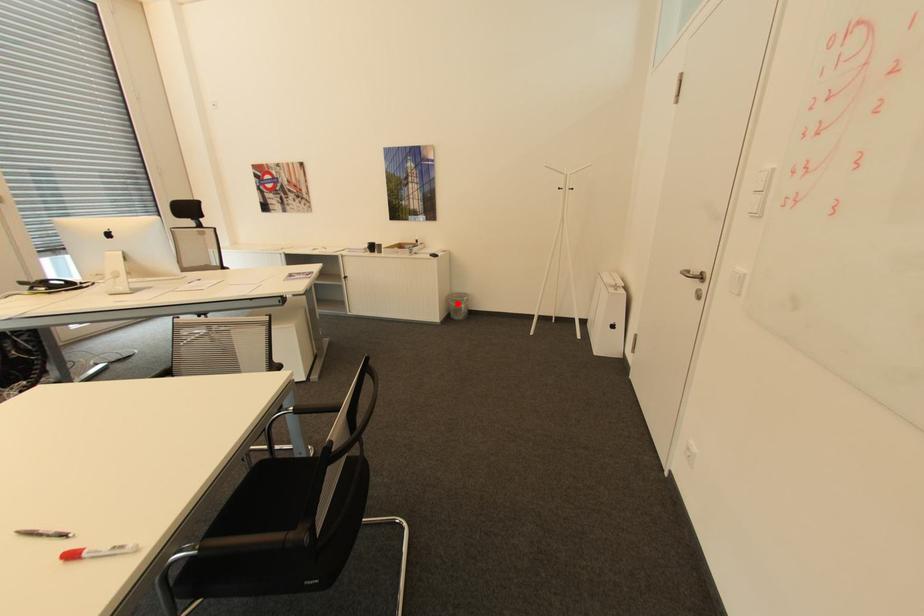
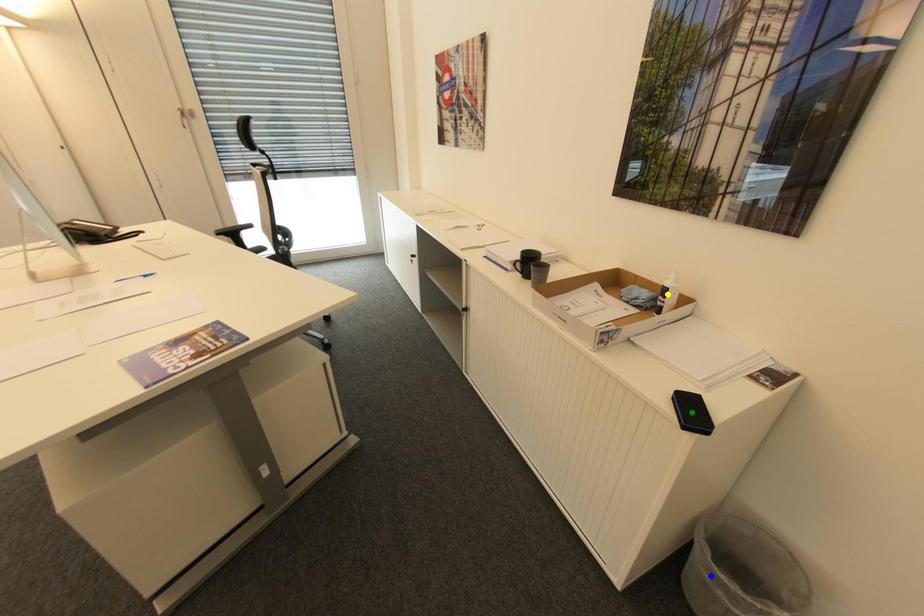
Question: I am providing you with two images of the same scene from different viewpoints. A red point is marked on the first image. You are given multiple points on the second image. Which point in image 2 represents the same 3d spot as the red point in image 1?

Choices:
 (A) yellow point
 (B) green point
 (C) blue point

Answer: (C)